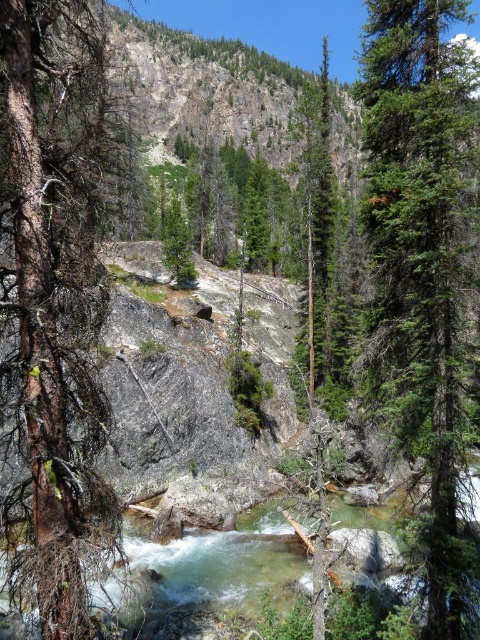
Who is more distant from viewer, [116,496] or [183,225]?

Positioned behind is point [183,225].

Is brown rough bark tree at left bigger than green matte tree at center?

Correct, brown rough bark tree at left is larger in size than green matte tree at center.

This screenshot has height=640, width=480. In order to click on brown rough bark tree at left in this screenshot , I will do `click(55, 296)`.

Is green matte tree at right wider than green matte tree at center?

No, green matte tree at right is not wider than green matte tree at center.

Which is more to the right, green matte tree at right or green matte tree at center?

Positioned to the right is green matte tree at right.

Is point (446, 246) more distant than point (180, 216)?

No, it is in front of (180, 216).

Locate an element on the screen. The image size is (480, 640). green matte tree at right is located at coordinates (416, 257).

Is point (178, 563) farther from viewer compared to point (172, 204)?

No, it is not.

Can you confirm if clear water at center is smaller than green matte tree at center?

Correct, clear water at center occupies less space than green matte tree at center.

Where is `clear water at center`? clear water at center is located at coordinates (211, 566).

Identify the location of clear water at center. (211, 566).